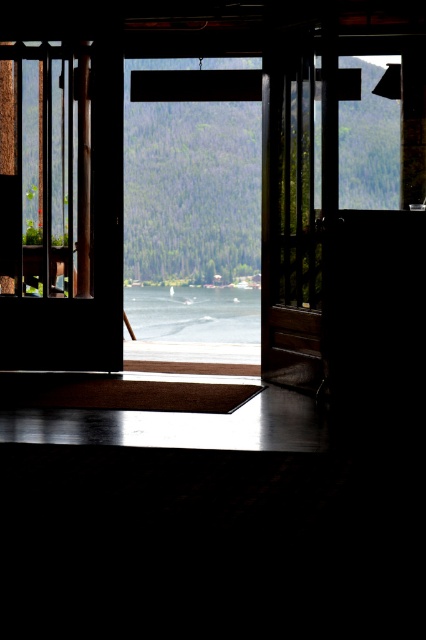
From the picture: You are a delivery person holding a large package that is 13 feet long. You need to carry it through the transparent glass window at center or the wooden door at center. Which one can you pass through without tilting the package?

The transparent glass window at center and wooden door at center are 13.44 feet apart from each other. Since the package is 13 feet long, it can fit through the space between them. However, the question is about passing through the objects themselves, not the space between them. The description does not provide the dimensions of the window or door individually, so it is impossible to determine which one the package can pass through without tilting.

You are standing in the dimly lit interior space and want to walk towards the doorway. Which point, point (63,292) or point (173,179), is closer to you as you move forward through the doorway?

Point (63,292) is closer to you because it is in front of point (173,179), meaning it is nearer to your position as you move forward through the doorway.

You are standing in a room and want to exit through the nearest door. You notice there are two doors available, the transparent glass door at left and the wooden door at center. Which door is taller?

The transparent glass door at left is taller than the wooden door at center.